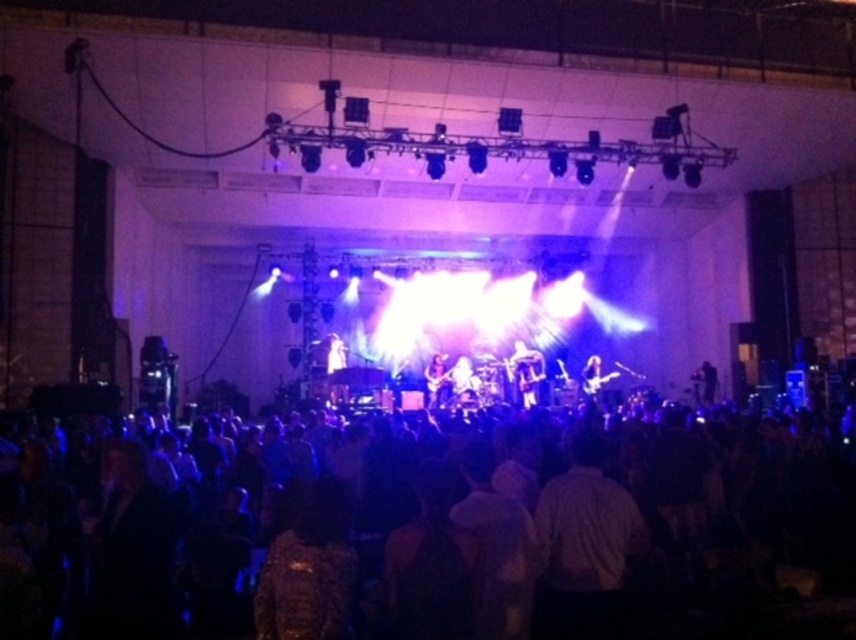
Question: Does shiny silver guitar at center lie in front of shiny black guitar at center?

Choices:
 (A) no
 (B) yes

Answer: (A)

Question: Estimate the real-world distances between objects in this image. Which object is closer to the shiny silver guitar at center?

Choices:
 (A) black fabric crowd at lower center
 (B) shiny black guitar at center

Answer: (B)

Question: Which object is closer to the camera taking this photo?

Choices:
 (A) shiny black guitar at center
 (B) black fabric crowd at lower center
 (C) shiny silver guitar at center

Answer: (B)

Question: Is black fabric crowd at lower center smaller than shiny silver guitar at center?

Choices:
 (A) no
 (B) yes

Answer: (A)

Question: Can you confirm if shiny silver guitar at center is positioned above shiny black guitar at center?

Choices:
 (A) no
 (B) yes

Answer: (B)

Question: Which object appears farthest from the camera in this image?

Choices:
 (A) black fabric crowd at lower center
 (B) shiny silver guitar at center
 (C) shiny black guitar at center

Answer: (B)